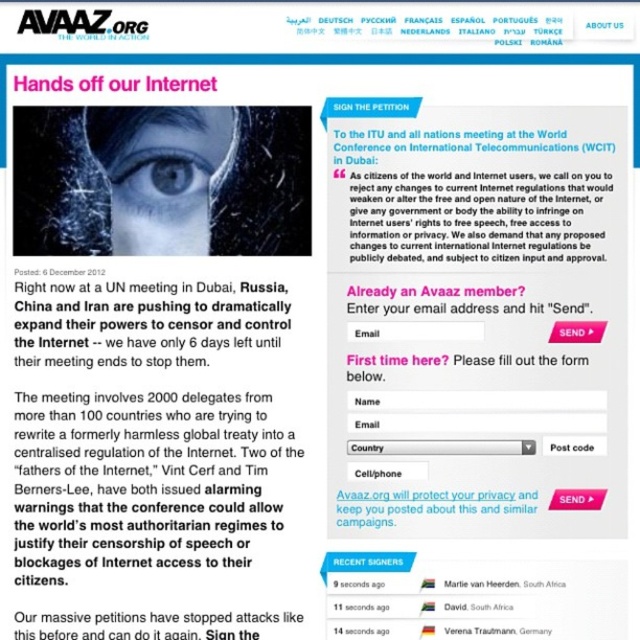
Does black paper text at lower center have a lesser height compared to blue glassy eye at center?

Indeed, black paper text at lower center has a lesser height compared to blue glassy eye at center.

Can you confirm if black paper text at lower center is wider than blue glassy eye at center?

Yes.

This screenshot has width=640, height=640. What do you see at coordinates (147, 625) in the screenshot? I see `black paper text at lower center` at bounding box center [147, 625].

Identify the location of black paper text at lower center. The width and height of the screenshot is (640, 640). (147, 625).

Based on the photo, who is positioned more to the right, white paper text at upper center or blue glassy eye at center?

Positioned to the right is white paper text at upper center.

Can you confirm if white paper text at upper center is thinner than blue glassy eye at center?

No.

Is point (364, 214) farther from camera compared to point (177, 164)?

Yes.

The width and height of the screenshot is (640, 640). Identify the location of white paper text at upper center. (474, 216).

Between white paper text at upper center and black paper text at lower center, which one has more height?

Standing taller between the two is white paper text at upper center.

Is white paper text at upper center thinner than black paper text at lower center?

Correct, white paper text at upper center's width is less than black paper text at lower center's.

The height and width of the screenshot is (640, 640). What are the coordinates of `white paper text at upper center` in the screenshot? It's located at (x=474, y=216).

Where is `white paper text at upper center`? white paper text at upper center is located at coordinates (474, 216).